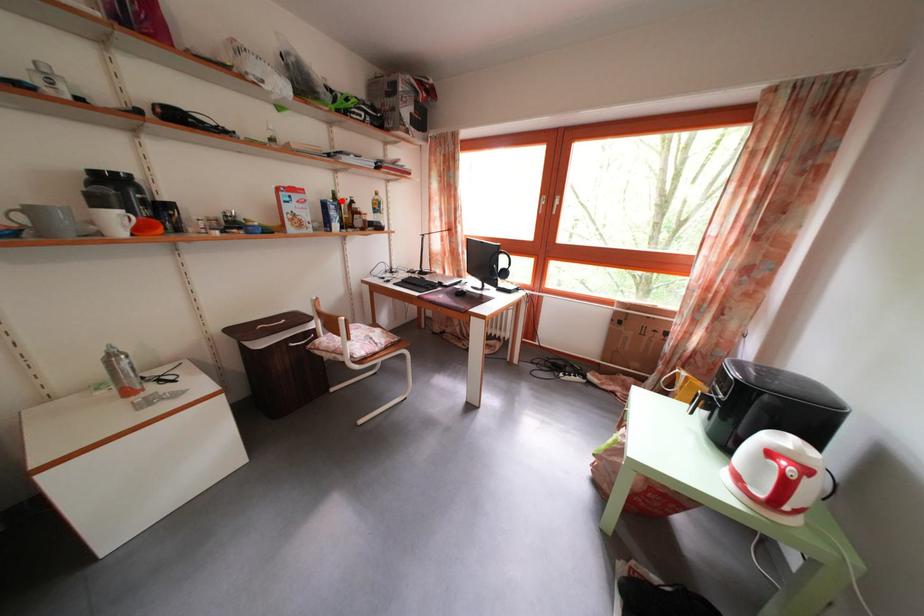
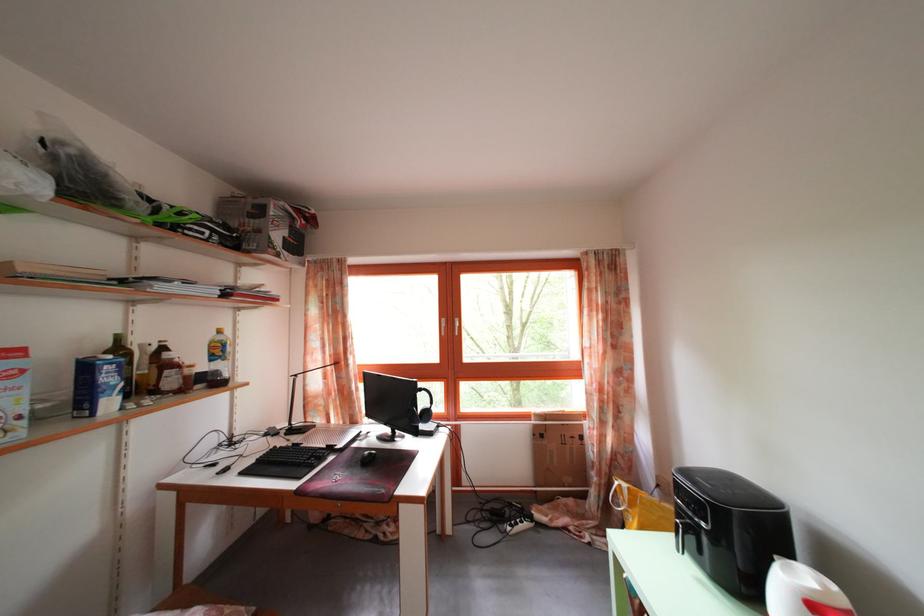
Question: I am providing you with two images of the same scene from different viewpoints. In image1, a red point is highlighted. Considering the same 3D point in image2, which of the following is correct?

Choices:
 (A) It is closer
 (B) It is farther

Answer: (B)